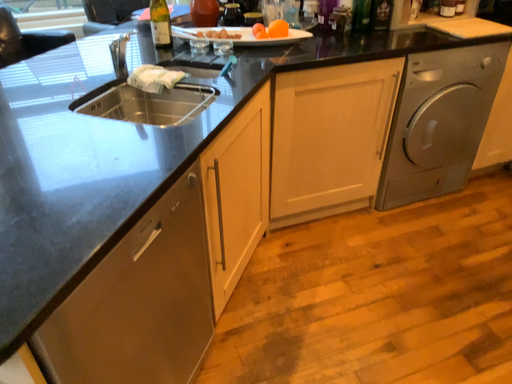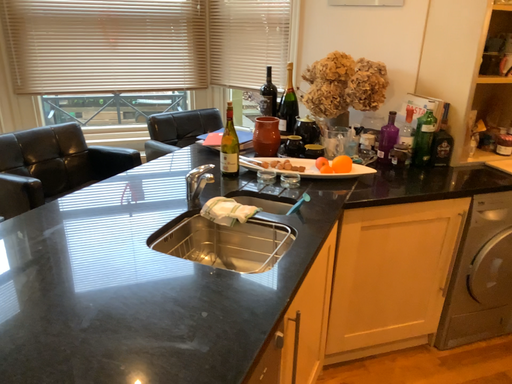
Question: How did the camera likely rotate when shooting the video?

Choices:
 (A) rotated downward
 (B) rotated upward

Answer: (B)